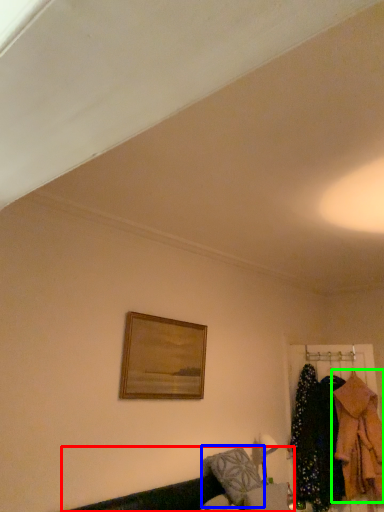
Question: Based on their relative distances, which object is nearer to couch (highlighted by a red box)? Choose from pillow (highlighted by a blue box) and clothing (highlighted by a green box).

Choices:
 (A) pillow
 (B) clothing

Answer: (A)